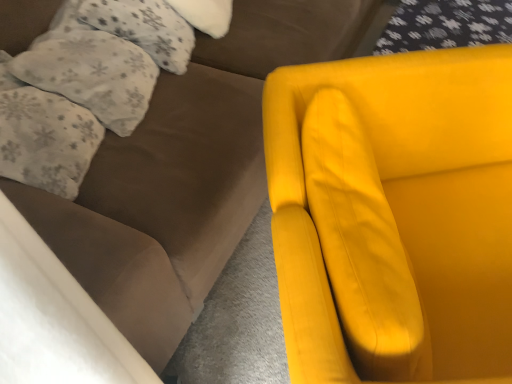
Question: From the image's perspective, would you say fluffy white pillow at upper left, the third pillow from the top, is positioned over fluffy white pillow at upper left, acting as the third pillow starting from the bottom?

Choices:
 (A) no
 (B) yes

Answer: (A)

Question: Is fluffy white pillow at upper left, the third pillow from the top, oriented towards fluffy white pillow at upper left, which is the first pillow from top to bottom?

Choices:
 (A) yes
 (B) no

Answer: (B)

Question: Is fluffy white pillow at upper left, the third pillow from the top, touching fluffy white pillow at upper left, acting as the third pillow starting from the bottom?

Choices:
 (A) no
 (B) yes

Answer: (A)

Question: Is fluffy white pillow at upper left, the third pillow from the top, facing away from fluffy white pillow at upper left, which is the first pillow from top to bottom?

Choices:
 (A) no
 (B) yes

Answer: (A)

Question: Is fluffy white pillow at upper left, the third pillow from the top, further to the viewer compared to fluffy white pillow at upper left, which is the first pillow from top to bottom?

Choices:
 (A) yes
 (B) no

Answer: (B)

Question: Considering the relative sizes of fluffy white pillow at upper left, which ranks as the 1th pillow in bottom-to-top order, and fluffy white pillow at upper left, acting as the third pillow starting from the bottom, in the image provided, is fluffy white pillow at upper left, which ranks as the 1th pillow in bottom-to-top order, bigger than fluffy white pillow at upper left, acting as the third pillow starting from the bottom,?

Choices:
 (A) yes
 (B) no

Answer: (A)

Question: Can you confirm if fluffy white pillow at upper left, which is the first pillow from top to bottom, is positioned to the left of white fluffy pillow at upper left, the second pillow when ordered from bottom to top?

Choices:
 (A) yes
 (B) no

Answer: (B)

Question: Does fluffy white pillow at upper left, acting as the third pillow starting from the bottom, turn towards white fluffy pillow at upper left, the second pillow when ordered from bottom to top?

Choices:
 (A) yes
 (B) no

Answer: (B)

Question: Is fluffy white pillow at upper left, which is the first pillow from top to bottom, not within white fluffy pillow at upper left, the second pillow when ordered from bottom to top?

Choices:
 (A) no
 (B) yes

Answer: (B)

Question: Does fluffy white pillow at upper left, acting as the third pillow starting from the bottom, have a greater height compared to white fluffy pillow at upper left, the second pillow when ordered from bottom to top?

Choices:
 (A) no
 (B) yes

Answer: (A)

Question: Is fluffy white pillow at upper left, which is the first pillow from top to bottom, facing away from white fluffy pillow at upper left, the second pillow positioned from the top?

Choices:
 (A) yes
 (B) no

Answer: (B)

Question: From a real-world perspective, is fluffy white pillow at upper left, acting as the third pillow starting from the bottom, on white fluffy pillow at upper left, the second pillow when ordered from bottom to top?

Choices:
 (A) yes
 (B) no

Answer: (B)

Question: Is matte yellow armchair at right touching fluffy white pillow at upper left, which ranks as the 1th pillow in bottom-to-top order?

Choices:
 (A) no
 (B) yes

Answer: (A)